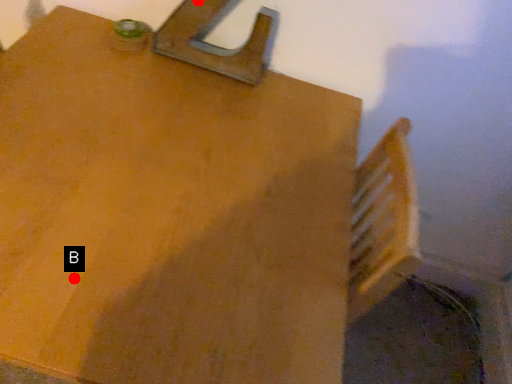
Question: Two points are circled on the image, labeled by A and B beside each circle. Which point is further to the camera?

Choices:
 (A) A is further
 (B) B is further

Answer: (A)